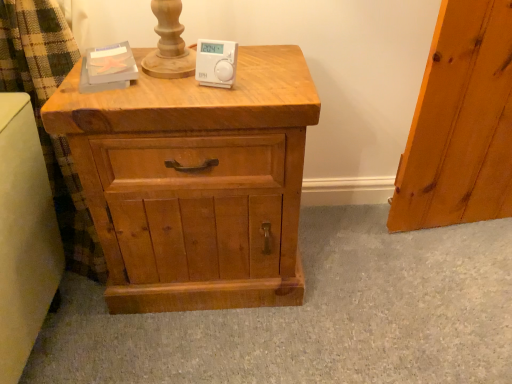
Question: Based on their sizes in the image, would you say white plastic thermostat at center is bigger or smaller than natural wood chest of drawers at center?

Choices:
 (A) big
 (B) small

Answer: (B)

Question: In the image, is white plastic thermostat at center positioned in front of or behind natural wood chest of drawers at center?

Choices:
 (A) behind
 (B) front

Answer: (A)

Question: From the image's perspective, is white plastic thermostat at center positioned above or below natural wood chest of drawers at center?

Choices:
 (A) below
 (B) above

Answer: (B)

Question: Does point (195, 301) appear closer or farther from the camera than point (219, 72)?

Choices:
 (A) closer
 (B) farther

Answer: (B)

Question: Would you say natural wood chest of drawers at center is inside or outside white plastic thermostat at center?

Choices:
 (A) outside
 (B) inside

Answer: (A)

Question: Is natural wood chest of drawers at center bigger or smaller than white plastic thermostat at center?

Choices:
 (A) small
 (B) big

Answer: (B)

Question: Is natural wood chest of drawers at center in front of or behind white plastic thermostat at center in the image?

Choices:
 (A) front
 (B) behind

Answer: (A)